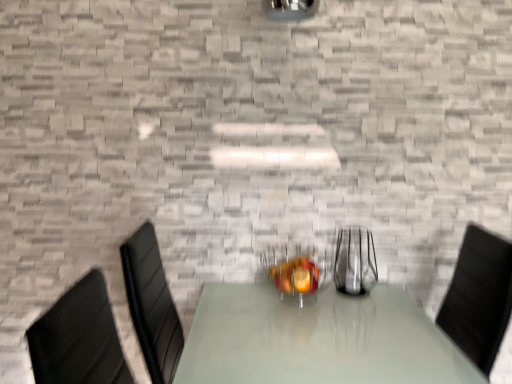
Question: In terms of size, does clear glass vase at center, the first tableware from the right, appear bigger or smaller than metallic silver fruit bowl at center, placed as the 2th tableware when sorted from right to left?

Choices:
 (A) small
 (B) big

Answer: (A)

Question: In terms of width, does clear glass vase at center, which is the second tableware from left to right, look wider or thinner when compared to metallic silver fruit bowl at center, placed as the 2th tableware when sorted from right to left?

Choices:
 (A) thin
 (B) wide

Answer: (A)

Question: Is point (367, 283) positioned closer to the camera than point (302, 271)?

Choices:
 (A) farther
 (B) closer

Answer: (A)

Question: In terms of height, does metallic silver fruit bowl at center, placed as the 2th tableware when sorted from right to left, look taller or shorter compared to clear glass vase at center, which is the second tableware from left to right?

Choices:
 (A) tall
 (B) short

Answer: (B)

Question: From a real-world perspective, is metallic silver fruit bowl at center, placed as the 2th tableware when sorted from right to left, positioned above or below clear glass vase at center, which is the second tableware from left to right?

Choices:
 (A) above
 (B) below

Answer: (B)

Question: Looking at the image, does metallic silver fruit bowl at center, positioned as the first tableware in left-to-right order, seem bigger or smaller compared to clear glass vase at center, the first tableware from the right?

Choices:
 (A) big
 (B) small

Answer: (A)

Question: Considering the positions of point (265, 256) and point (347, 254), is point (265, 256) closer or farther from the camera than point (347, 254)?

Choices:
 (A) closer
 (B) farther

Answer: (B)